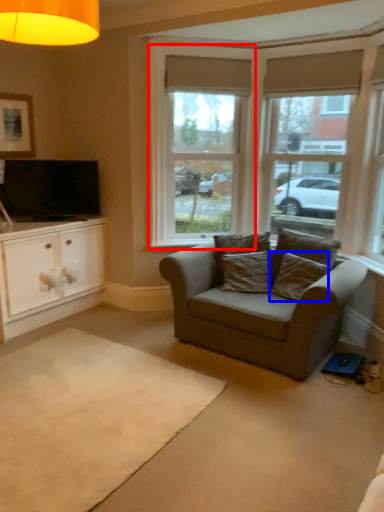
Question: Which point is closer to the camera, window (highlighted by a red box) or pillow (highlighted by a blue box)?

Choices:
 (A) window
 (B) pillow

Answer: (B)